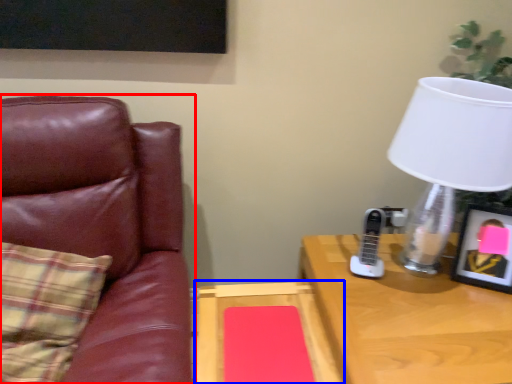
Question: Which point is closer to the camera, chair (highlighted by a red box) or table (highlighted by a blue box)?

Choices:
 (A) chair
 (B) table

Answer: (A)